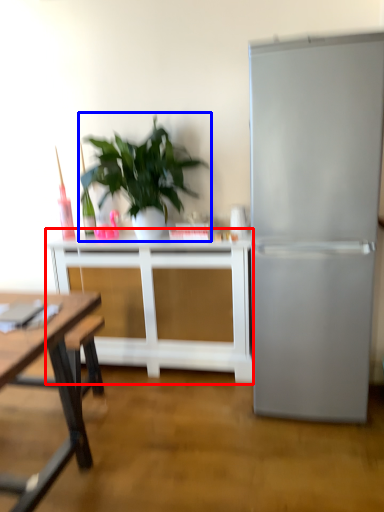
Question: Which object is further to the camera taking this photo, table (highlighted by a red box) or houseplant (highlighted by a blue box)?

Choices:
 (A) table
 (B) houseplant

Answer: (A)